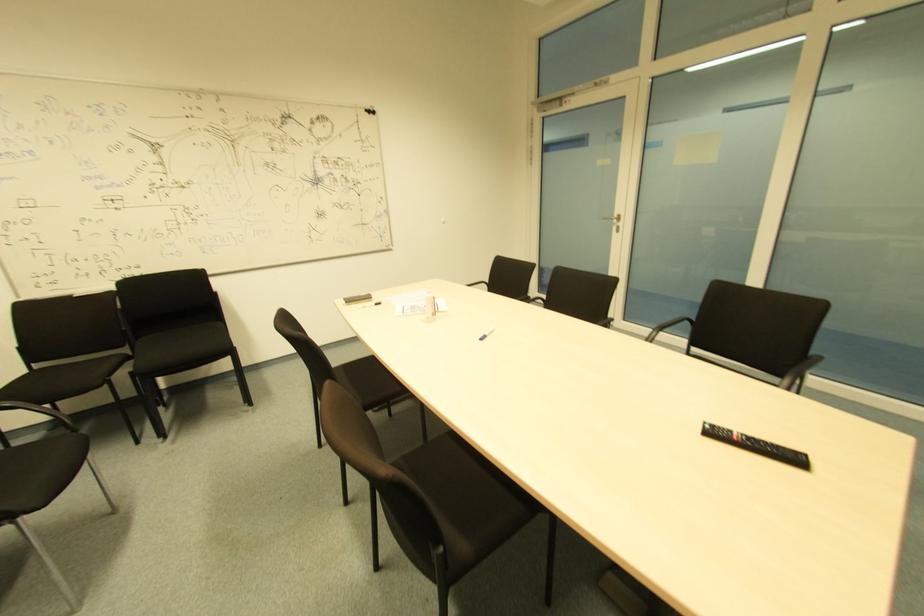
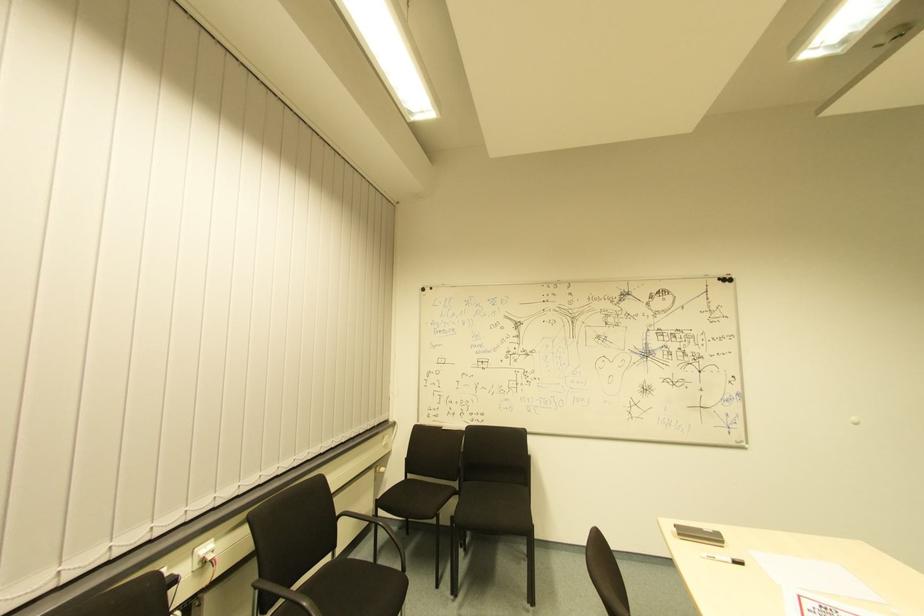
The images are taken continuously from a first-person perspective. In which direction is your viewpoint rotating?

Result: The camera rotated toward left-up.